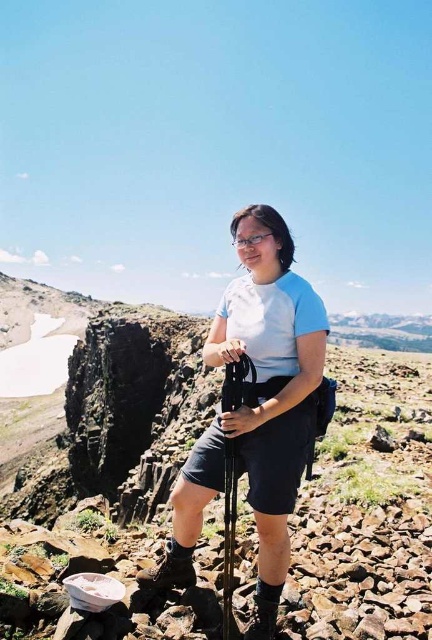
Question: In this image, where is blue fabric shirt at center located relative to black matte ski pole at center?

Choices:
 (A) left
 (B) right

Answer: (A)

Question: Is blue fabric shirt at center further to camera compared to black matte ski pole at center?

Choices:
 (A) no
 (B) yes

Answer: (B)

Question: From the image, what is the correct spatial relationship of blue fabric shirt at center in relation to black matte ski pole at center?

Choices:
 (A) below
 (B) above

Answer: (B)

Question: Which point is closer to the camera?

Choices:
 (A) (180, 541)
 (B) (231, 579)

Answer: (B)